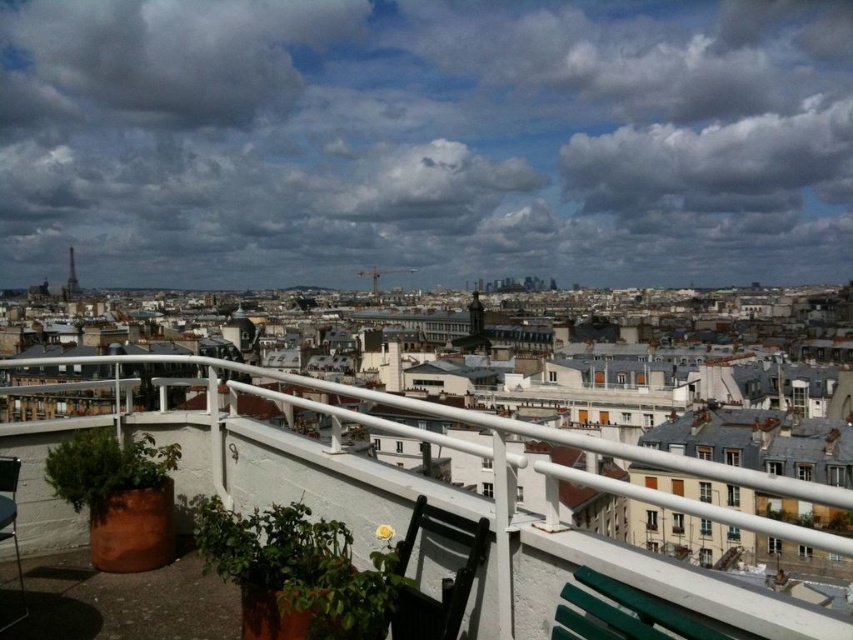
You are standing on the rooftop terrace and want to look at two points in the city. The first point is at coordinate point (645, 632) and the second is at point (0, 522). Which point is closer to you when you are facing the city?

Point (645, 632) is in front of point (0, 522), so the first point is closer to you when facing the city.

You are a delivery drone that needs to fly from the green plastic chair at lower right to the metallic silver chair at lower left. The drone has a maximum flight range of 30 meters. Can it make the trip without recharging?

The distance between the green plastic chair at lower right and the metallic silver chair at lower left is 30.24 meters, which exceeds the drone s 30 meter range. Therefore, the drone cannot complete the trip without recharging.

In the scene shown: You are a delivery person trying to place a package between the black plastic chair at lower center and the green plastic chair at lower right. The package requires 30 feet of space to fit. Can you fit the package between them?

The black plastic chair at lower center and green plastic chair at lower right are 30.18 feet apart, so yes, the package requiring 30 feet of space can fit between them.